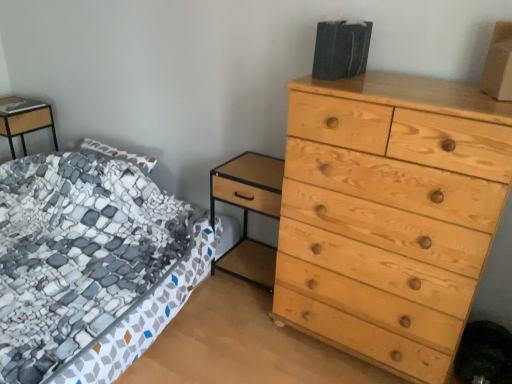
Question: Could light wood/texture nightstand at center, the second nightstand from the top, be considered to be inside patterned fabric bed at left?

Choices:
 (A) yes
 (B) no

Answer: (A)

Question: Is patterned fabric bed at left in contact with light wood/texture nightstand at center, the second nightstand from the top?

Choices:
 (A) no
 (B) yes

Answer: (A)

Question: Is light wood/texture nightstand at center, the second nightstand when ordered from left to right, at the back of patterned fabric bed at left?

Choices:
 (A) no
 (B) yes

Answer: (A)

Question: From the image's perspective, is patterned fabric bed at left under light wood/texture nightstand at center, which appears as the first nightstand when viewed from the front?

Choices:
 (A) no
 (B) yes

Answer: (B)

Question: Does patterned fabric bed at left have a lesser width compared to light wood/texture nightstand at center, the 2th nightstand viewed from the back?

Choices:
 (A) no
 (B) yes

Answer: (A)

Question: Can you confirm if patterned fabric bed at left is bigger than light wood/texture nightstand at center, which appears as the first nightstand when viewed from the front?

Choices:
 (A) yes
 (B) no

Answer: (A)

Question: Does light wood/texture nightstand at center, the 2th nightstand viewed from the back, have a lesser height compared to patterned fabric bed at left?

Choices:
 (A) no
 (B) yes

Answer: (A)

Question: From the image's perspective, is light wood/texture nightstand at center, which appears as the first nightstand when viewed from the front, above patterned fabric bed at left?

Choices:
 (A) no
 (B) yes

Answer: (B)

Question: Is light wood/texture nightstand at center, which appears as the first nightstand when viewed from the front, next to patterned fabric bed at left and touching it?

Choices:
 (A) yes
 (B) no

Answer: (B)

Question: Is light wood/texture nightstand at center, the second nightstand from the top, further to the viewer compared to patterned fabric bed at left?

Choices:
 (A) no
 (B) yes

Answer: (B)

Question: Does light wood/texture nightstand at center, the 1th nightstand viewed from the right, appear on the left side of patterned fabric bed at left?

Choices:
 (A) no
 (B) yes

Answer: (A)

Question: Considering the relative sizes of light wood/texture nightstand at center, which appears as the first nightstand when viewed from the front, and patterned fabric bed at left in the image provided, is light wood/texture nightstand at center, which appears as the first nightstand when viewed from the front, smaller than patterned fabric bed at left?

Choices:
 (A) yes
 (B) no

Answer: (A)

Question: Is matte wood nightstand at left, the 2th nightstand positioned from the bottom, further to camera compared to light wood/texture nightstand at center, the second nightstand from the top?

Choices:
 (A) no
 (B) yes

Answer: (B)